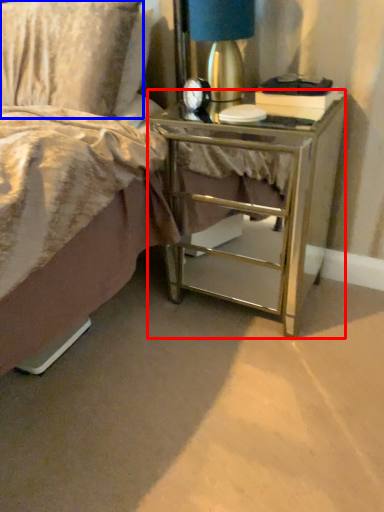
Question: Which of the following is the farthest to the observer, nightstand (highlighted by a red box) or pillow (highlighted by a blue box)?

Choices:
 (A) nightstand
 (B) pillow

Answer: (B)